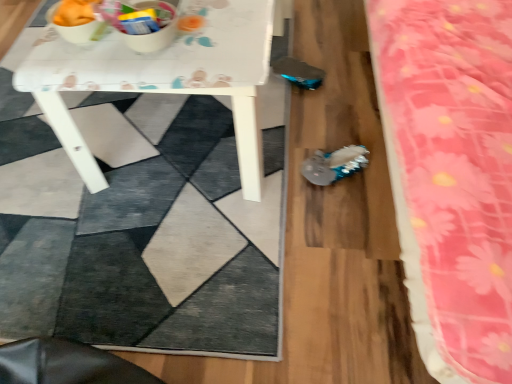
Where is `free space to the left of shiny metallic shoe at center`? This screenshot has width=512, height=384. free space to the left of shiny metallic shoe at center is located at coordinates click(x=280, y=182).